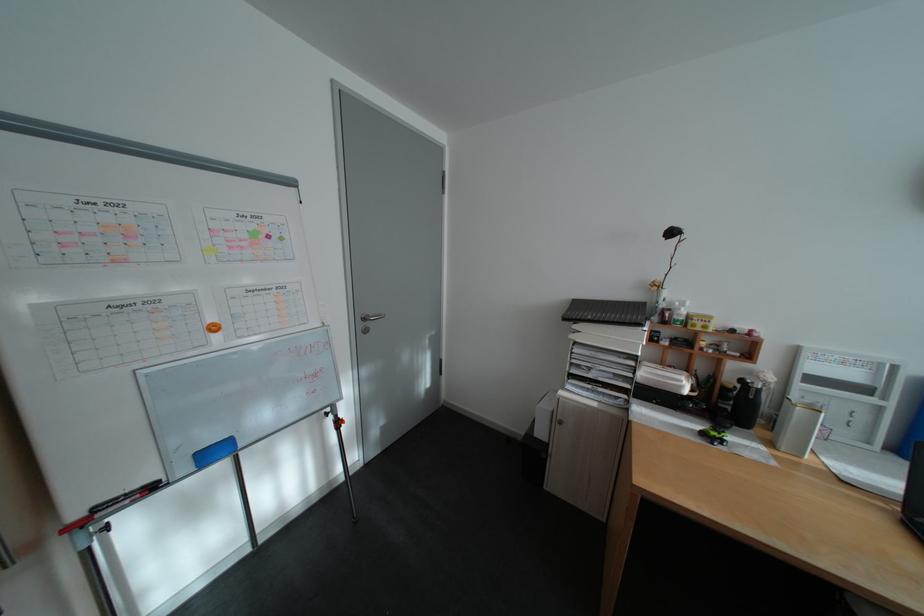
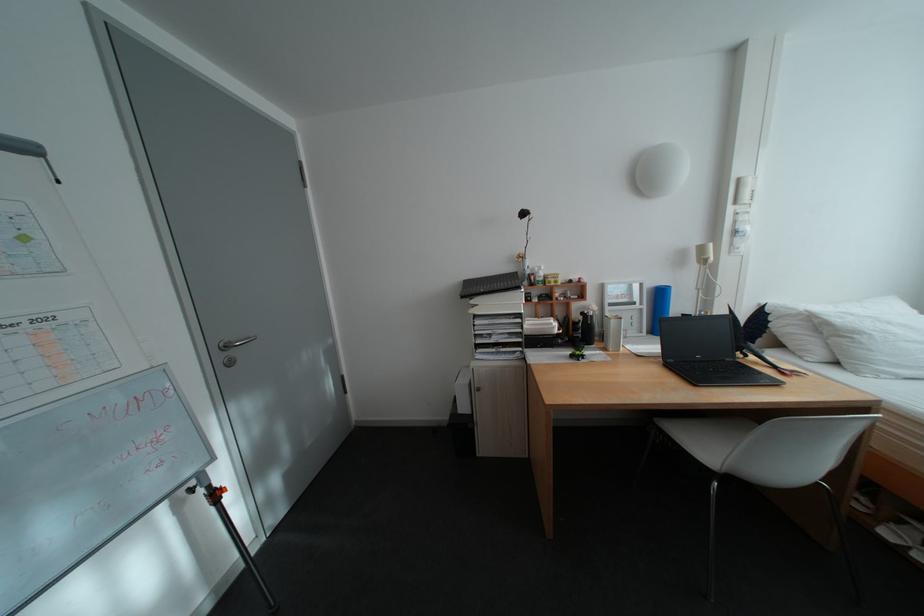
Where in the second image is the point corresponding to point 374,326 from the first image?

(234, 358)